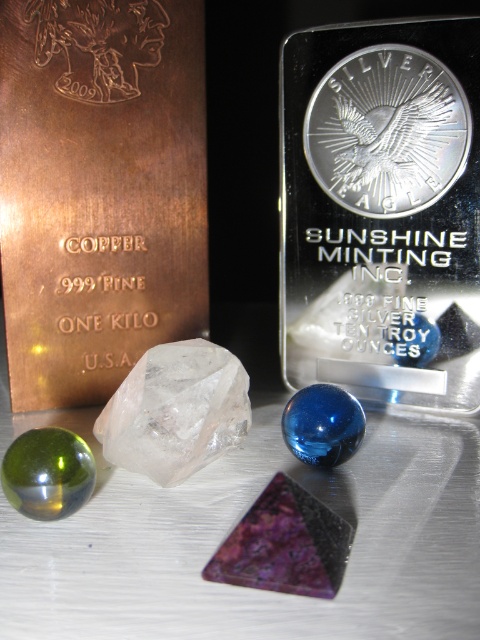
Question: Can you confirm if silver/metallic coin at center-right is positioned to the right of green glass sphere at center?

Choices:
 (A) no
 (B) yes

Answer: (B)

Question: Which point is closer to the camera taking this photo?

Choices:
 (A) (432, 67)
 (B) (48, 493)

Answer: (B)

Question: Can you confirm if silver/metallic coin at center-right is wider than green glass sphere at center?

Choices:
 (A) no
 (B) yes

Answer: (B)

Question: Is silver/metallic coin at center-right below green glass sphere at center?

Choices:
 (A) yes
 (B) no

Answer: (B)

Question: Which point is closer to the camera?

Choices:
 (A) silver/metallic coin at center-right
 (B) green glass sphere at center

Answer: (B)